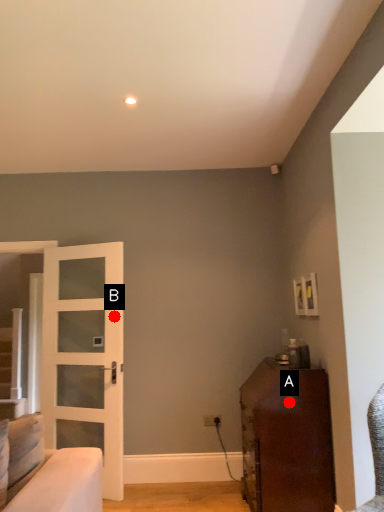
Question: Two points are circled on the image, labeled by A and B beside each circle. Which point is closer to the camera?

Choices:
 (A) A is closer
 (B) B is closer

Answer: (A)